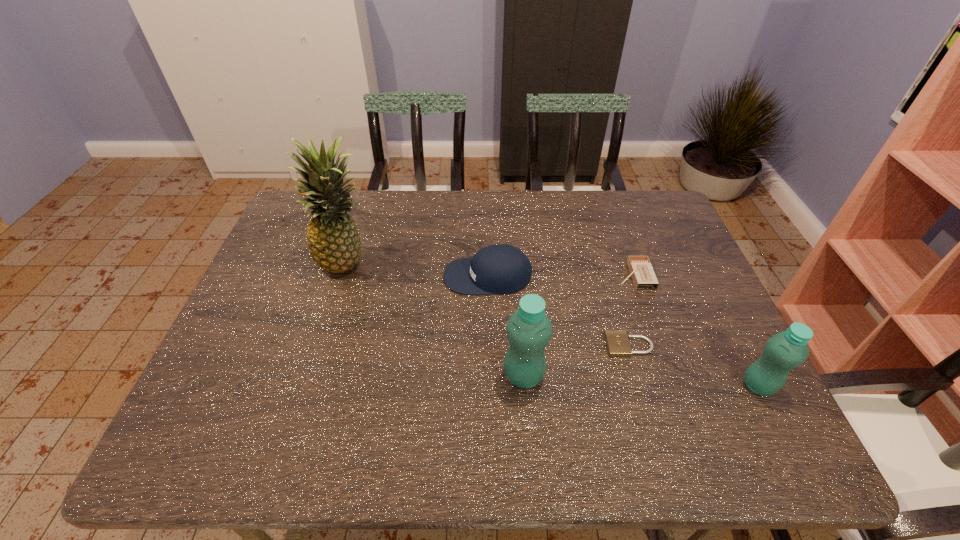
The image size is (960, 540). In order to click on free region located 0.320m at the front cap of the taller water bottle in this screenshot , I will do `click(684, 376)`.

Locate an element on the screen. vacant space located at the front cap of the shorter water bottle is located at coordinates (631, 386).

This screenshot has width=960, height=540. Identify the location of free space located at the front cap of the shorter water bottle. (636, 386).

At what (x,y) coordinates should I click in order to perform the action: click on vacant space located 0.260m at the front cap of the shorter water bottle. Please return your answer as a coordinate pair (x, y). Looking at the image, I should click on (626, 386).

At what (x,y) coordinates should I click in order to perform the action: click on free space located on the striking surface of the fifth tallest object. Please return your answer as a coordinate pair (x, y). Looking at the image, I should click on (547, 275).

You are a GUI agent. You are given a task and a screenshot of the screen. Output one action in this format:
    pyautogui.click(x=<x>, y=<y>)
    Task: Click on the vacant area situated 0.060m on the striking surface of the fifth tallest object
    
    Given the screenshot: What is the action you would take?
    pyautogui.click(x=597, y=275)

Where is `vacant area situated on the striking surface of the fifth tallest object`? vacant area situated on the striking surface of the fifth tallest object is located at coordinates (589, 275).

I want to click on blank space located on the back of the third nearest object, so click(x=614, y=295).

At what (x,y) coordinates should I click in order to perform the action: click on vacant space located 0.060m on the front of the tallest object. Please return your answer as a coordinate pair (x, y). Looking at the image, I should click on (336, 300).

Find the location of a particular element. Image resolution: width=960 pixels, height=540 pixels. free spot located 0.180m on the front-facing side of the baseball cap is located at coordinates (380, 276).